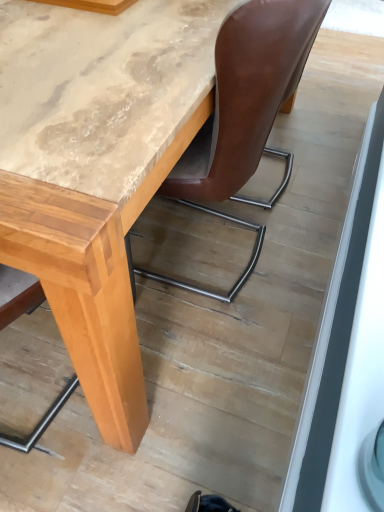
In order to face brown leather chair at center, should I rotate leftwards or rightwards?

To align with it, rotate left about 0.999°.

Describe the element at coordinates (243, 115) in the screenshot. I see `brown leather chair at center` at that location.

Find the location of a particular element. The width and height of the screenshot is (384, 512). brown leather chair at center is located at coordinates (243, 115).

The width and height of the screenshot is (384, 512). I want to click on brown leather chair at center, so [243, 115].